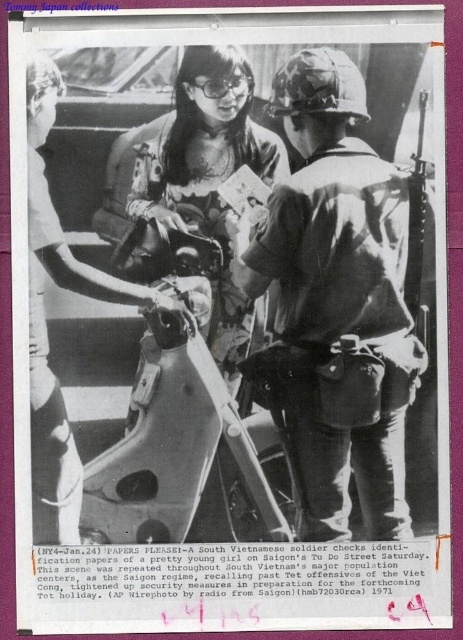
Question: Is camouflage fabric helmet at center below floral-patterned blouse at center?

Choices:
 (A) no
 (B) yes

Answer: (B)

Question: Which of the following is the farthest from the observer?

Choices:
 (A) (193, 92)
 (B) (400, 211)

Answer: (B)

Question: Is camouflage fabric helmet at center positioned in front of matte black goggles at upper center?

Choices:
 (A) yes
 (B) no

Answer: (A)

Question: Estimate the real-world distances between objects in this image. Which object is farther from the matte black goggles at upper center?

Choices:
 (A) floral-patterned blouse at center
 (B) camouflage fabric helmet at center

Answer: (B)

Question: Based on their relative distances, which object is nearer to the floral-patterned blouse at center?

Choices:
 (A) camouflage fabric helmet at center
 (B) matte black goggles at upper center

Answer: (A)

Question: Is floral-patterned blouse at center above matte black goggles at upper center?

Choices:
 (A) no
 (B) yes

Answer: (A)